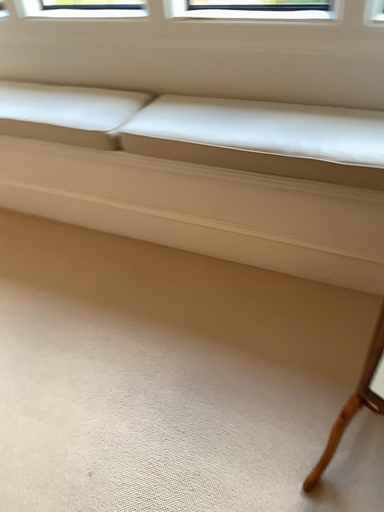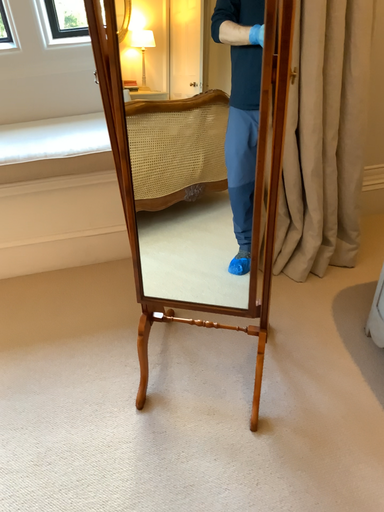
Question: How did the camera likely rotate when shooting the video?

Choices:
 (A) rotated upward
 (B) rotated downward

Answer: (A)